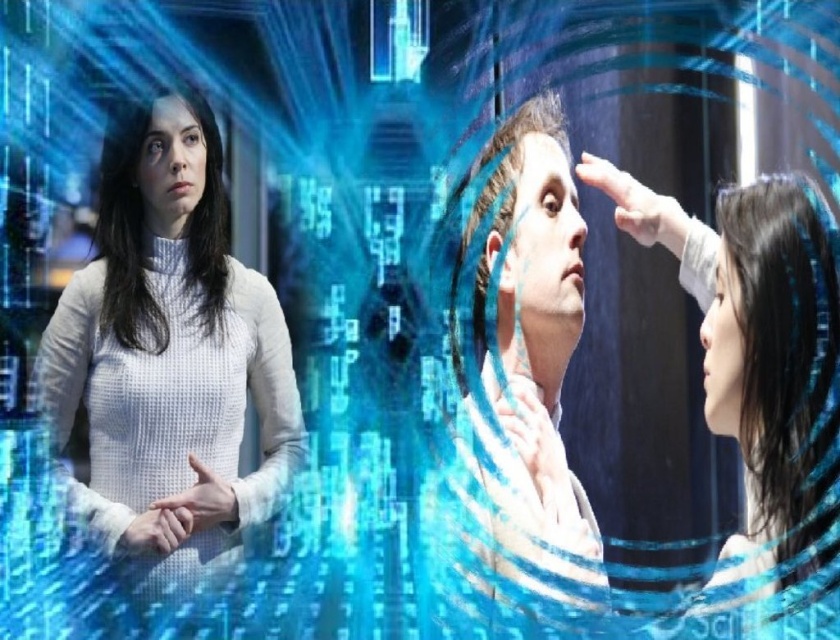
Question: Is smooth black hair at right above blonde hair at center?

Choices:
 (A) no
 (B) yes

Answer: (A)

Question: In this image, where is smooth black hair at right located relative to white matte hand at center?

Choices:
 (A) left
 (B) right

Answer: (B)

Question: Which point is closer to the camera?

Choices:
 (A) (777, 323)
 (B) (135, 145)
 (C) (546, 410)

Answer: (A)

Question: Which object is the farthest from the black silky hair at right?

Choices:
 (A) smooth skin hand at center right
 (B) white soft hand at center

Answer: (A)

Question: Can you confirm if blonde hair at center is thinner than matte white forehead at upper left?

Choices:
 (A) no
 (B) yes

Answer: (A)

Question: Among these objects, which one is farthest from the camera?

Choices:
 (A) black silky hair at right
 (B) smooth skin hand at center right
 (C) white soft hand at center
 (D) smooth skin forehead at center

Answer: (B)